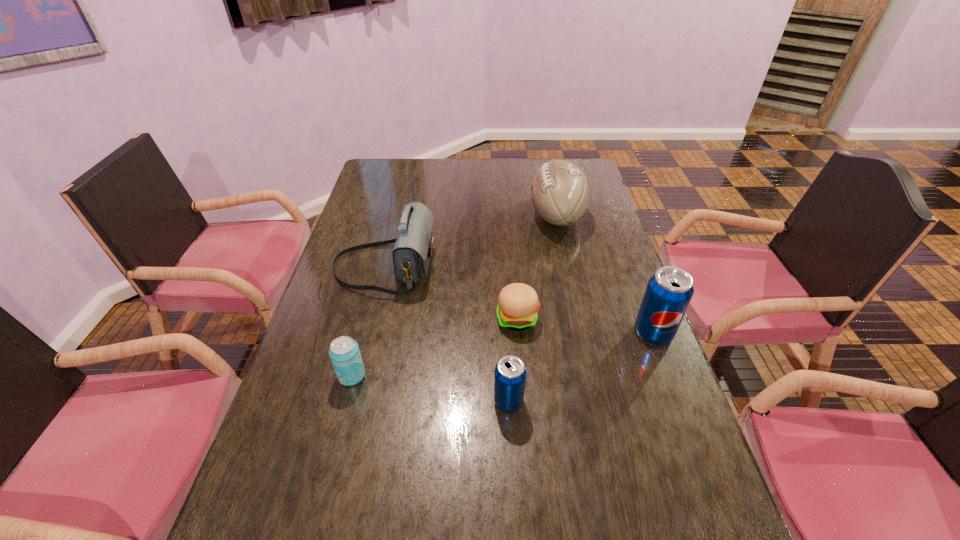
Identify the location of free spot between the right pop soda and the nearest object. (581, 367).

The image size is (960, 540). I want to click on empty space that is in between the right pop soda and the second object from right to left, so click(x=605, y=274).

Where is `free area in between the farther pop soda and the football (American)`? The image size is (960, 540). free area in between the farther pop soda and the football (American) is located at coordinates (605, 274).

Image resolution: width=960 pixels, height=540 pixels. I want to click on unoccupied position between the nearest object and the farther pop soda, so click(x=581, y=367).

Choose which object is the fourth nearest neighbor to the beer can. Please provide its 2D coordinates. Your answer should be formatted as a tuple, i.e. [(x, y)], where the tuple contains the x and y coordinates of a point satisfying the conditions above.

[(559, 192)]

Locate an element on the screen. the second closest object to the shortest object is located at coordinates (411, 254).

Locate an element on the screen. The height and width of the screenshot is (540, 960). free space that satisfies the following two spatial constraints: 1. on the back side of the second nearest object; 2. on the right side of the hamburger is located at coordinates (367, 319).

Locate an element on the screen. free space that satisfies the following two spatial constraints: 1. on the front side of the shoulder bag; 2. on the right side of the rightmost object is located at coordinates (368, 333).

The width and height of the screenshot is (960, 540). What are the coordinates of `free region that satisfies the following two spatial constraints: 1. on the laces of the football (American); 2. on the front side of the fifth farthest object` in the screenshot? It's located at (592, 376).

Where is `vacant space that satisfies the following two spatial constraints: 1. on the laces of the football (American); 2. on the front side of the shortest object`? vacant space that satisfies the following two spatial constraints: 1. on the laces of the football (American); 2. on the front side of the shortest object is located at coordinates (580, 319).